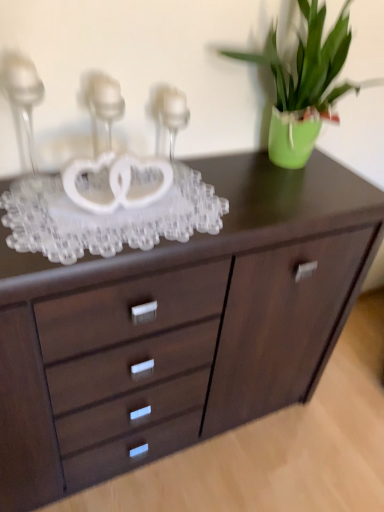
Find the location of a particular element. The width and height of the screenshot is (384, 512). free space to the right of clear glass candle holder at upper left, acting as the first candle holder starting from the left is located at coordinates (102, 201).